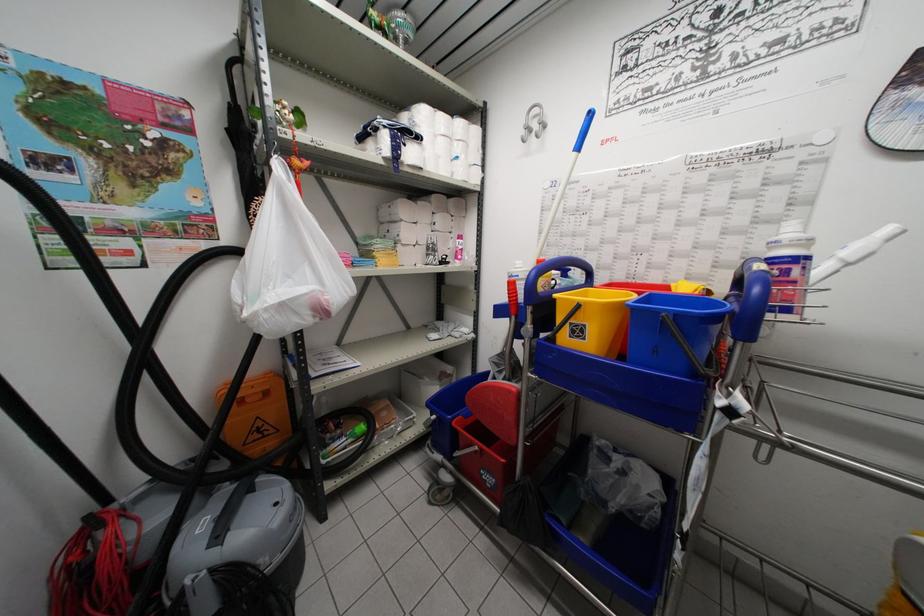
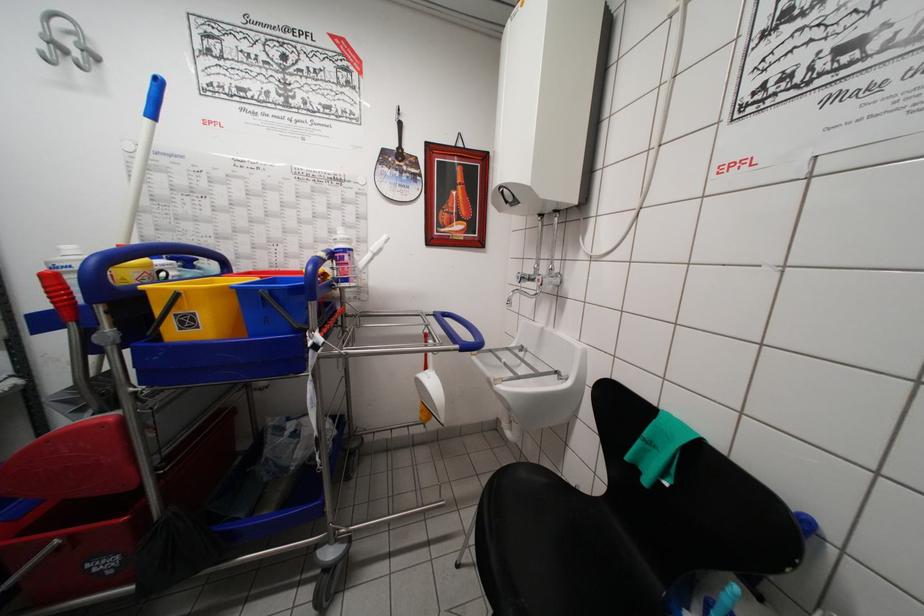
Where in the second image is the point corresponding to pixel 546 124 from the first image?

(92, 51)